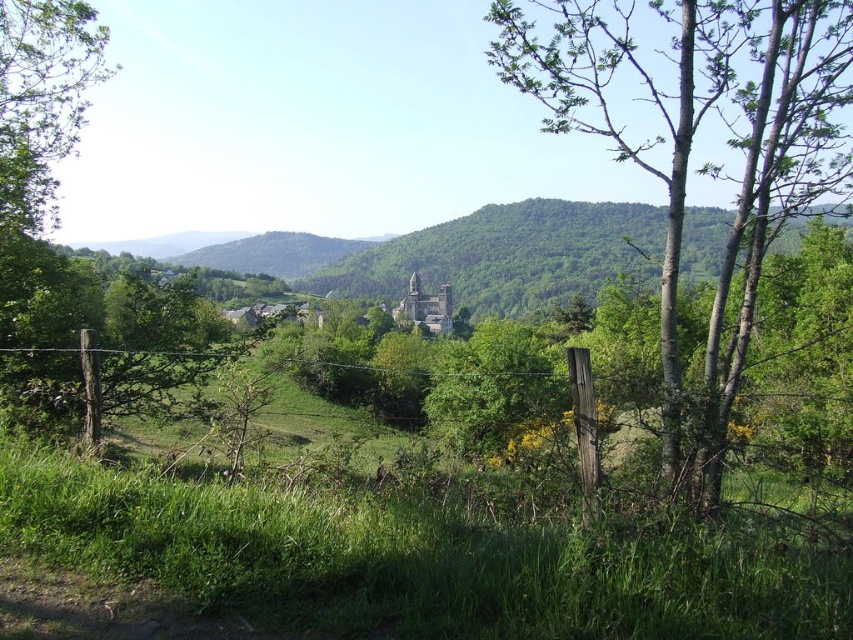
Which is above, green bark tree at center or green forested mountain at center?

green bark tree at center

Consider the image. Who is more distant from viewer, (798, 176) or (699, 252)?

The point (699, 252) is more distant.

Locate an element on the screen. green bark tree at center is located at coordinates (689, 145).